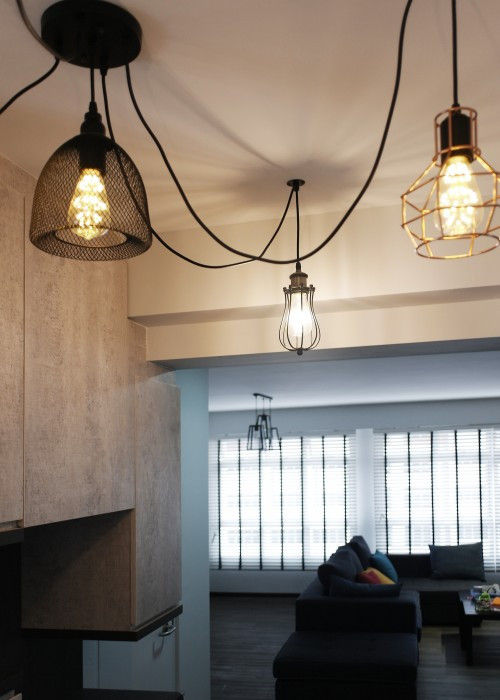
Find the location of a particular element. This screenshot has width=500, height=700. white lightbulb is located at coordinates (296, 318).